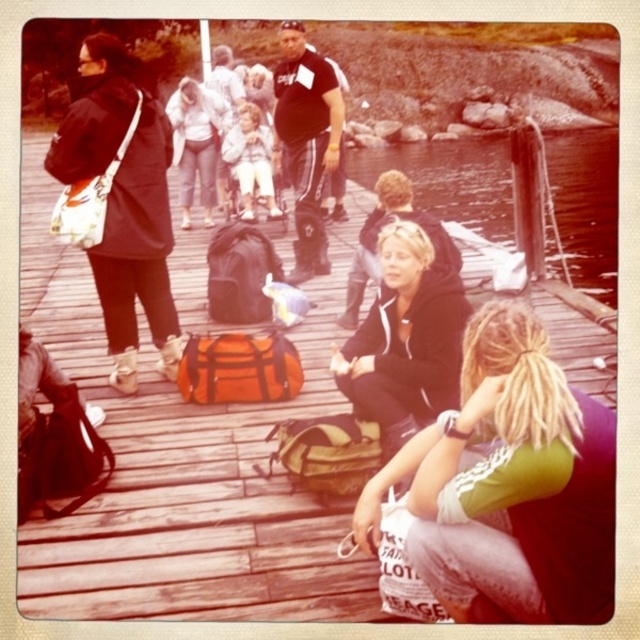
Is matte black jacket at left positioned at the back of clear water at dock center?

No.

Which is more to the left, matte black jacket at left or clear water at dock center?

matte black jacket at left

You are a GUI agent. You are given a task and a screenshot of the screen. Output one action in this format:
    pyautogui.click(x=<x>, y=<y>)
    Task: Click on the matte black jacket at left
    This screenshot has height=640, width=640.
    Given the screenshot: What is the action you would take?
    coord(122,198)

Which is behind, point (321, 506) or point (180, 182)?

The point (180, 182) is behind.

Image resolution: width=640 pixels, height=640 pixels. Identify the location of wooden dock at center. (182, 467).

Where is `wooden dock at center`? The width and height of the screenshot is (640, 640). wooden dock at center is located at coordinates (182, 467).

Between green jersey at lower right and matte white shirt at upper center, which one has more height?

matte white shirt at upper center

What do you see at coordinates (509, 484) in the screenshot? I see `green jersey at lower right` at bounding box center [509, 484].

At what (x,y) coordinates should I click in order to perform the action: click on green jersey at lower right. Please return your answer as a coordinate pair (x, y). Looking at the image, I should click on pos(509,484).